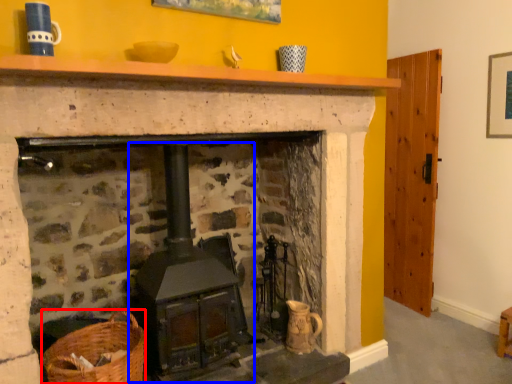
Question: Which of the following is the farthest to the observer, basket (highlighted by a red box) or stove (highlighted by a blue box)?

Choices:
 (A) basket
 (B) stove

Answer: (B)